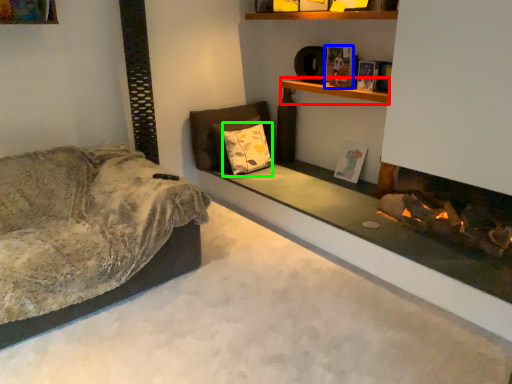
Question: Considering the real-world distances, which object is farthest from shelf (highlighted by a red box)? book (highlighted by a blue box) or pillow (highlighted by a green box)?

Choices:
 (A) book
 (B) pillow

Answer: (B)